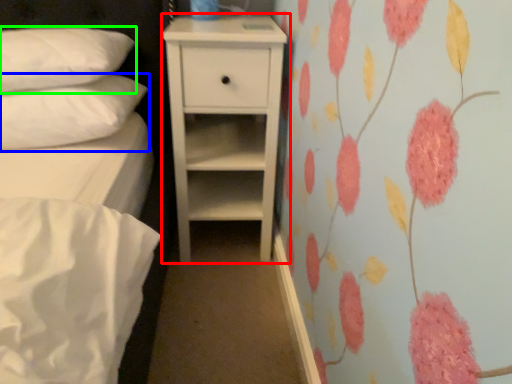
Question: Which object is positioned closest to chest of drawers (highlighted by a red box)? Select from pillow (highlighted by a blue box) and pillow (highlighted by a green box).

Choices:
 (A) pillow
 (B) pillow

Answer: (A)